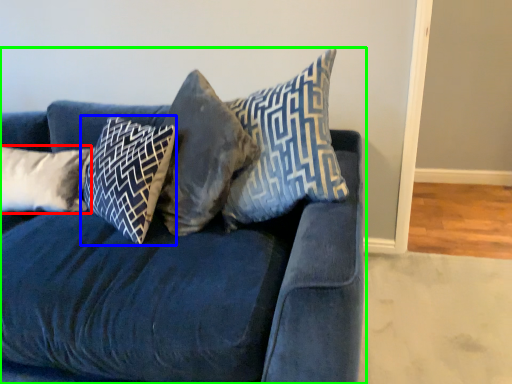
Question: Which is nearer to the pillow (highlighted by a red box)? pillow (highlighted by a blue box) or studio couch (highlighted by a green box).

Choices:
 (A) pillow
 (B) studio couch

Answer: (A)